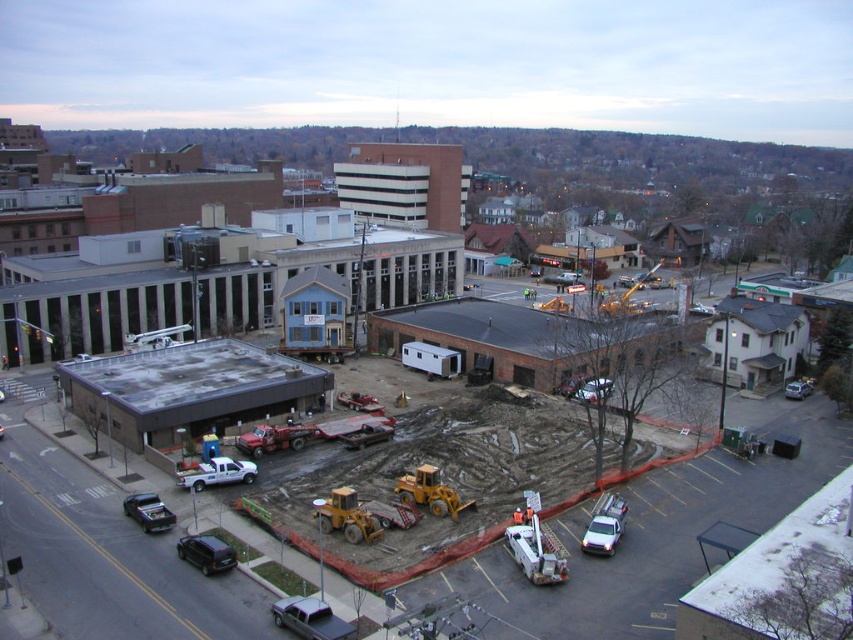
Question: Can you confirm if shiny black sedan at lower left is thinner than metallic silver sedan at center?

Choices:
 (A) no
 (B) yes

Answer: (B)

Question: Which object appears farthest from the camera in this image?

Choices:
 (A) metallic silver sedan at center
 (B) shiny black sedan at lower left

Answer: (A)

Question: Can you confirm if shiny black sedan at lower left is wider than metallic silver sedan at center?

Choices:
 (A) no
 (B) yes

Answer: (A)

Question: Is shiny black sedan at lower left in front of metallic silver sedan at center?

Choices:
 (A) yes
 (B) no

Answer: (A)

Question: Among these objects, which one is nearest to the camera?

Choices:
 (A) metallic silver sedan at center
 (B) shiny black sedan at lower left

Answer: (B)